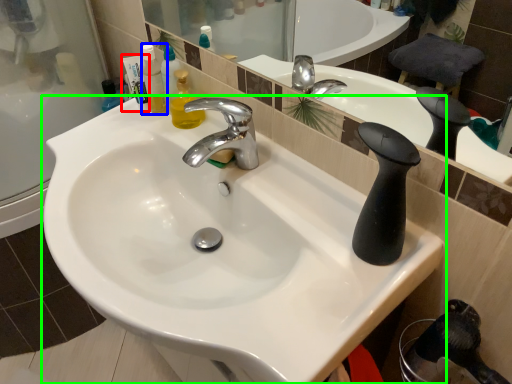
Question: Which object is the farthest from toiletry (highlighted by a red box)? Choose among these: mouthwash (highlighted by a blue box) or sink (highlighted by a green box).

Choices:
 (A) mouthwash
 (B) sink

Answer: (B)